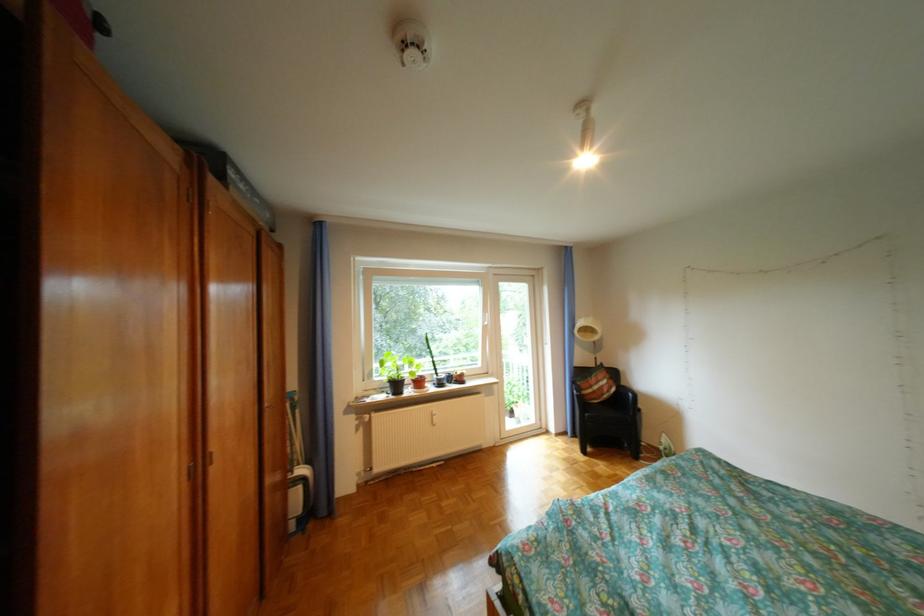
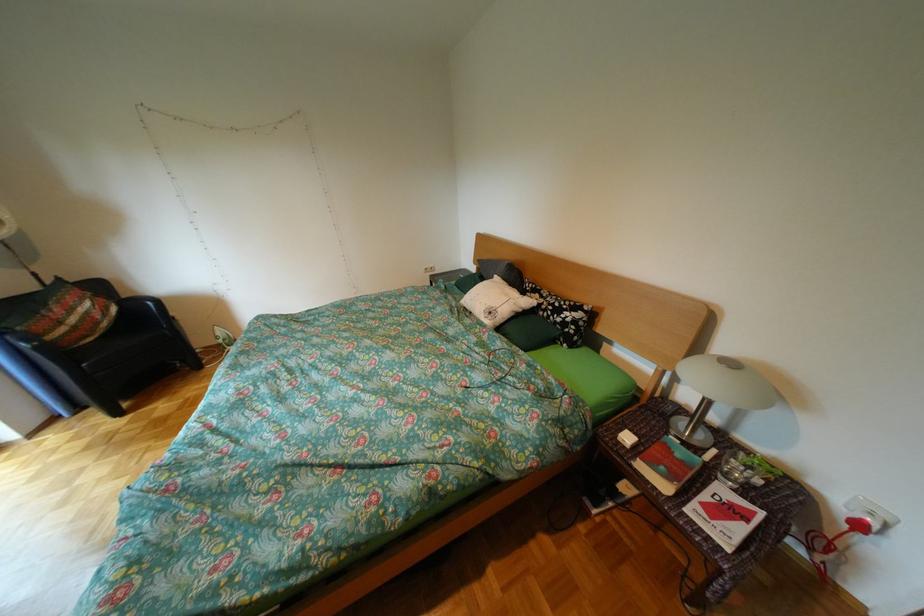
The first image is from the beginning of the video and the second image is from the end. How did the camera likely rotate when shooting the video?

The camera's rotation is toward right-down.